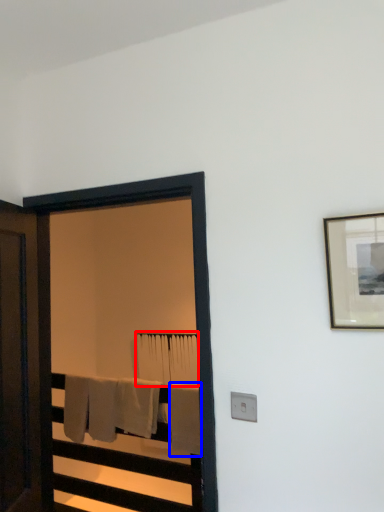
Question: Which point is further to the camera, bath towel (highlighted by a red box) or bath towel (highlighted by a blue box)?

Choices:
 (A) bath towel
 (B) bath towel

Answer: (A)